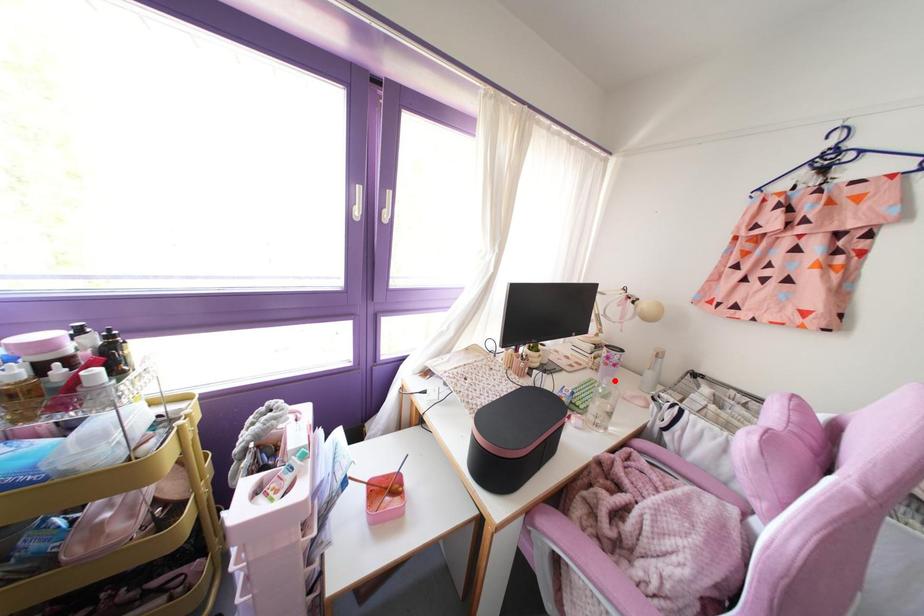
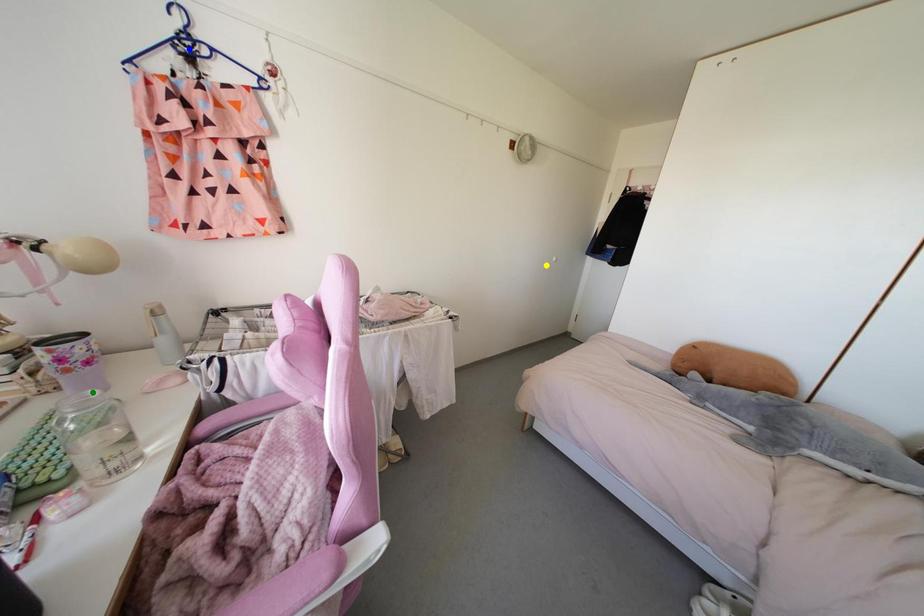
Question: I am providing you with two images of the same scene from different viewpoints. A red point is marked on the first image. You are given multiple points on the second image. In image 2, which mark is for the same physical point as the one in image 1?

Choices:
 (A) blue point
 (B) green point
 (C) yellow point

Answer: (B)